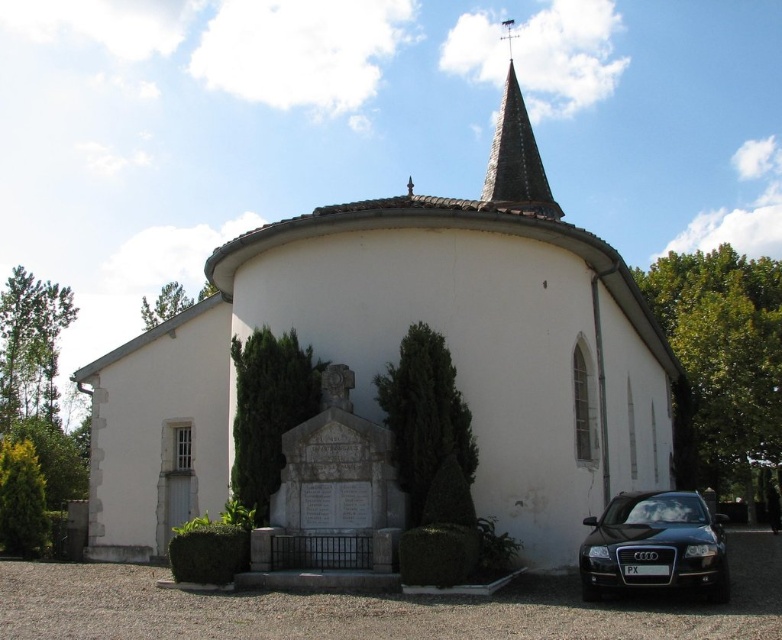
Question: Is green leafy tree at center bigger than green leafy tree at upper left?

Choices:
 (A) no
 (B) yes

Answer: (A)

Question: In this image, where is satin black car at lower right located relative to green leafy tree at center?

Choices:
 (A) left
 (B) right

Answer: (B)

Question: Which of the following is the closest to the observer?

Choices:
 (A) (310, 387)
 (B) (432, 474)

Answer: (B)

Question: Which point is closer to the camera?

Choices:
 (A) (684, 492)
 (B) (167, 285)
 (C) (4, 340)
 (D) (524, 173)

Answer: (A)

Question: Can you confirm if green leafy tree at left is wider than green leafy tree at lower left?

Choices:
 (A) no
 (B) yes

Answer: (B)

Question: Based on their relative distances, which object is nearer to the brown stonework spire at upper center?

Choices:
 (A) white smooth church at center
 (B) green leafy tree at lower left

Answer: (A)